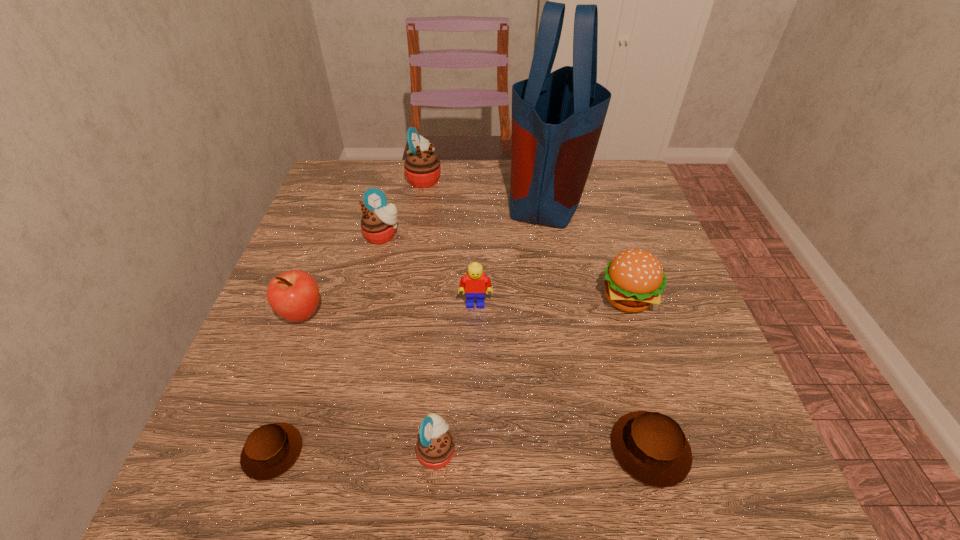
This screenshot has width=960, height=540. In order to click on vacant point located between the red handbag and the fourth shortest muffin in this screenshot , I will do `click(466, 214)`.

Identify the location of vacant region between the shortest object and the farthest pink muffin. (348, 315).

Where is `free space between the farthest pink muffin and the shortest object`? Image resolution: width=960 pixels, height=540 pixels. free space between the farthest pink muffin and the shortest object is located at coordinates (348, 315).

What are the coordinates of `free area in between the handbag and the farthest pink muffin` in the screenshot? It's located at (487, 186).

The width and height of the screenshot is (960, 540). I want to click on free space between the hamburger and the handbag, so click(x=588, y=246).

This screenshot has width=960, height=540. I want to click on vacant region between the apple and the tallest muffin, so [363, 246].

I want to click on blank region between the apple and the red handbag, so click(425, 254).

Find the location of a particular element. This screenshot has width=960, height=540. empty space that is in between the right brown muffin and the farthest muffin is located at coordinates (537, 314).

Find the location of `vacant area that lies between the tallest muffin and the fourth shortest muffin`. vacant area that lies between the tallest muffin and the fourth shortest muffin is located at coordinates pos(403,207).

Image resolution: width=960 pixels, height=540 pixels. I want to click on free space between the Lego and the second farthest muffin, so click(429, 269).